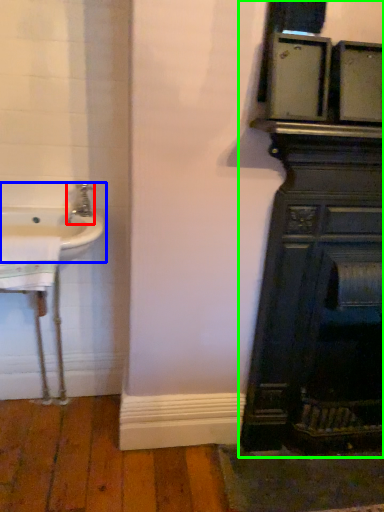
Question: Considering the real-world distances, which object is closest to tap (highlighted by a red box)? sink (highlighted by a blue box) or bathroom cabinet (highlighted by a green box).

Choices:
 (A) sink
 (B) bathroom cabinet

Answer: (A)